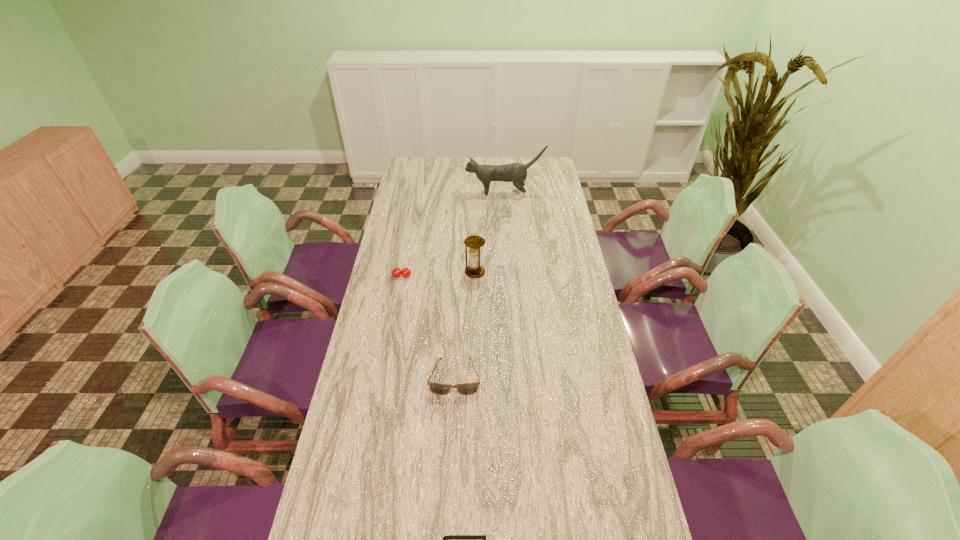
The width and height of the screenshot is (960, 540). Find the location of `blank space located on the back of the fourth shortest object`. blank space located on the back of the fourth shortest object is located at coordinates (475, 208).

This screenshot has width=960, height=540. What are the coordinates of `vacant point located 0.170m with the stems of the third tallest object pointing upwards` in the screenshot? It's located at (396, 312).

Locate an element on the screen. This screenshot has height=540, width=960. vacant area located 0.160m on the frames of the farther sunglasses is located at coordinates (451, 447).

In order to click on object at the left edge in this screenshot , I will do `click(396, 272)`.

At what (x,y) coordinates should I click in order to perform the action: click on object that is positioned at the right edge. Please return your answer as a coordinate pair (x, y). Looking at the image, I should click on (516, 173).

You are a GUI agent. You are given a task and a screenshot of the screen. Output one action in this format:
    pyautogui.click(x=<x>, y=<y>)
    Task: Click on the free region at the left edge
    The image size is (960, 540).
    Given the screenshot: What is the action you would take?
    pyautogui.click(x=392, y=357)

This screenshot has height=540, width=960. In the image, there is a desktop. What are the coordinates of `vacant area at the right edge` in the screenshot? It's located at (613, 465).

Locate an element on the screen. The width and height of the screenshot is (960, 540). free space at the far left corner is located at coordinates (412, 161).

In order to click on empty space between the fourth shortest object and the cherry in this screenshot , I will do `click(439, 274)`.

I want to click on vacant space that is in between the third tallest object and the tallest object, so click(453, 235).